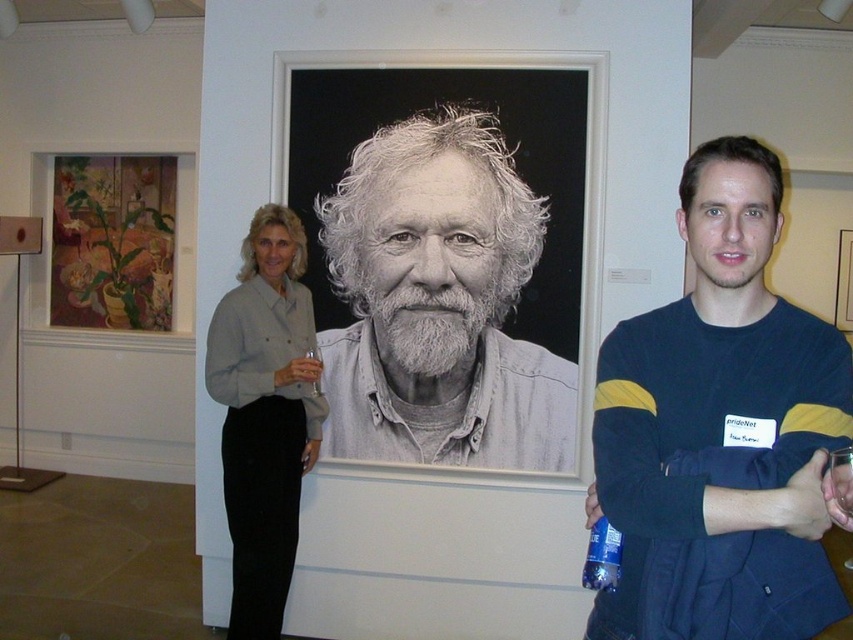
You are a photographer trying to capture a photo of the gray matte portrait at center and the blue plastic bottle at center. You need to ensure both are in focus. Given that your camera can focus on objects within a 1.5 meter range, will both objects be in focus?

The gray matte portrait at center and the blue plastic bottle at center are 1.65 meters apart, which exceeds the camera focus range of 1.5 meters. Therefore, both objects cannot be in focus simultaneously.

You are an art student trying to sketch the scene. You notice a point at coordinates (265, 413). What object is located at this point?

The light gray shirt at center is located at point (265, 413).